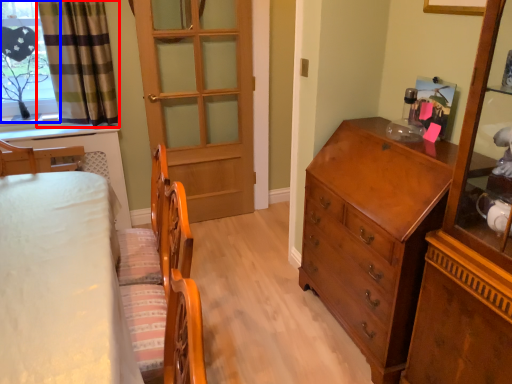
Question: Among these objects, which one is farthest to the camera, curtain (highlighted by a red box) or window (highlighted by a blue box)?

Choices:
 (A) curtain
 (B) window

Answer: (B)